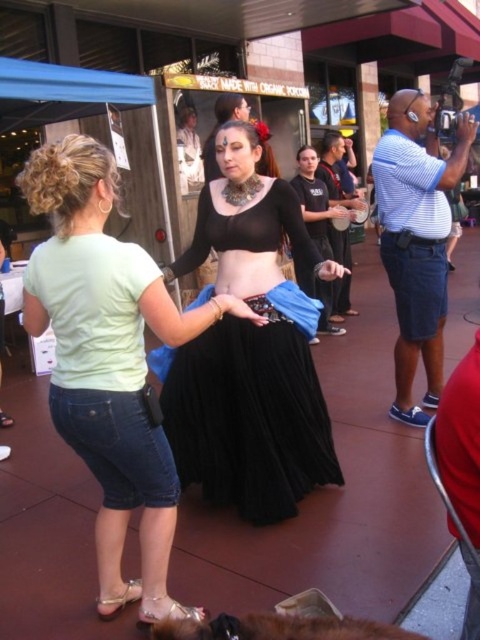
Is black satin skirt at center taller than black pleated skirt at center?

Yes, black satin skirt at center is taller than black pleated skirt at center.

From the picture: Can you confirm if black satin skirt at center is wider than black pleated skirt at center?

In fact, black satin skirt at center might be narrower than black pleated skirt at center.

I want to click on black satin skirt at center, so [x=108, y=360].

I want to click on black satin skirt at center, so click(108, 360).